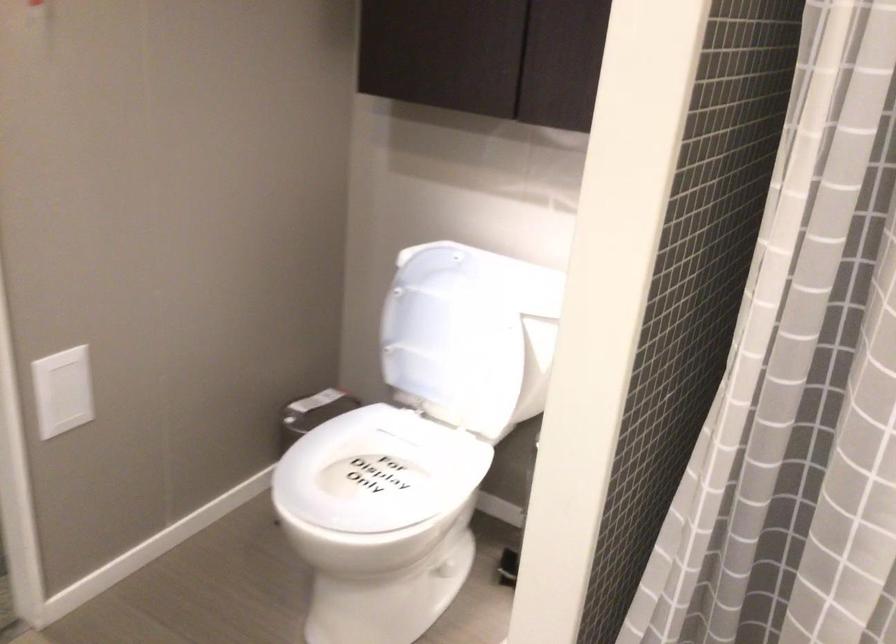
What do you see at coordinates (62, 391) in the screenshot? I see `a white wall switch` at bounding box center [62, 391].